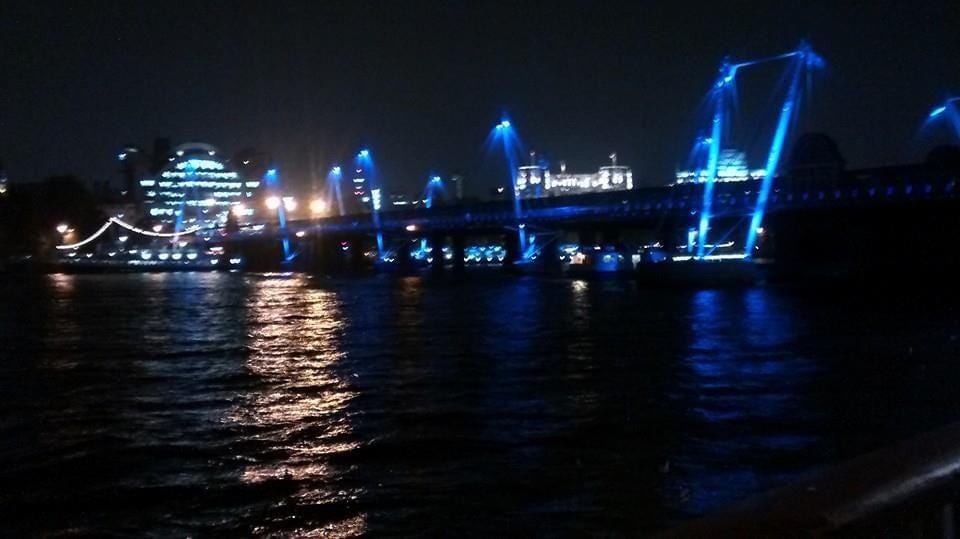
The image size is (960, 539). I want to click on light, so click(505, 131).